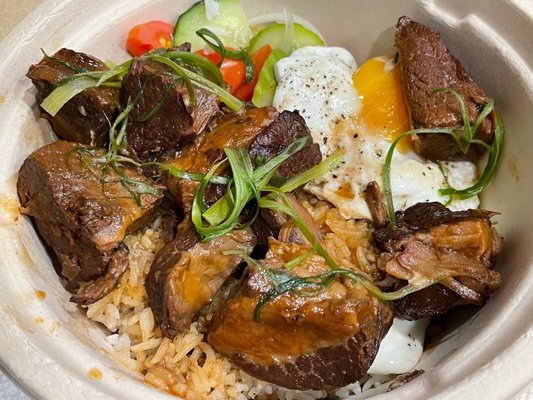
This screenshot has height=400, width=533. I want to click on bowl porcelain white, so click(x=103, y=21).